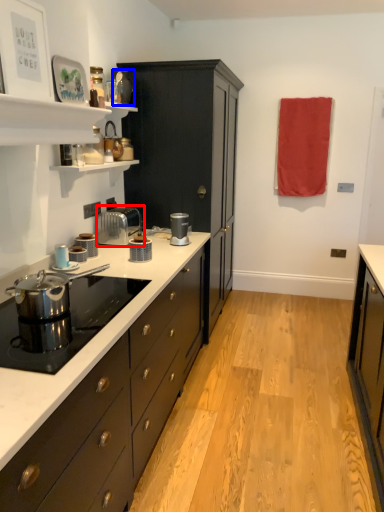
Question: Among these objects, which one is farthest to the camera, toaster (highlighted by a red box) or appliance (highlighted by a blue box)?

Choices:
 (A) toaster
 (B) appliance

Answer: (B)